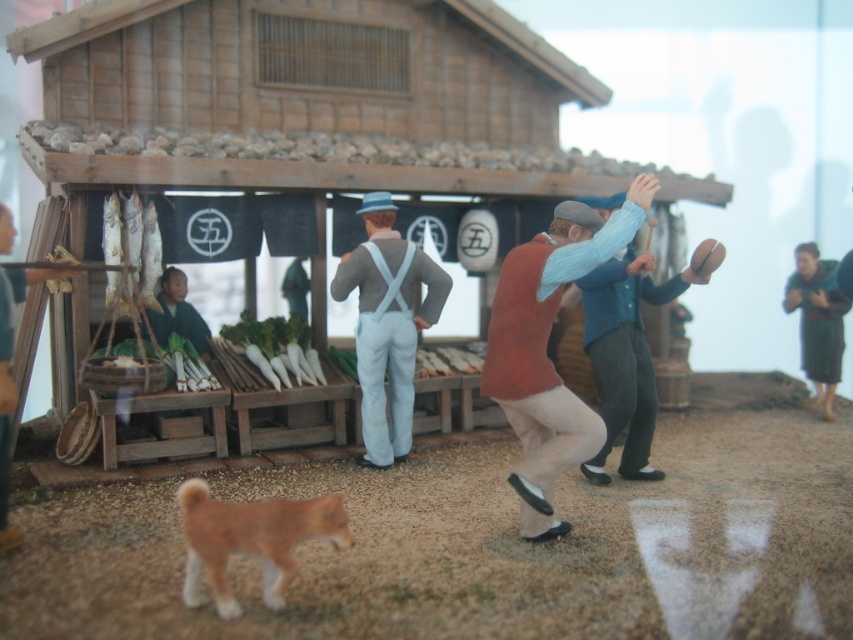
You are a customer at the market stall and notice both the matte gray suspenders at center and the green woolen sweater at right. Which item is closer to you as you stand in front of the stall?

The matte gray suspenders at center is closer to you because it is in front of the green woolen sweater at right.

You are a customer at the market and see both the light blue sweater at center and the green woolen sweater at right. Which sweater is nearer to you?

The light blue sweater at center is closer to the viewer than the green woolen sweater at right.

You are organizing a clothing display in the wooden stall and need to place the light blue sweater at center and the green woolen sweater at right next to each other. Which sweater should you place on the left side to ensure they fit properly?

You should place the light blue sweater at center on the left side because it is wider than the green woolen sweater at right, allowing for proper spacing between them.